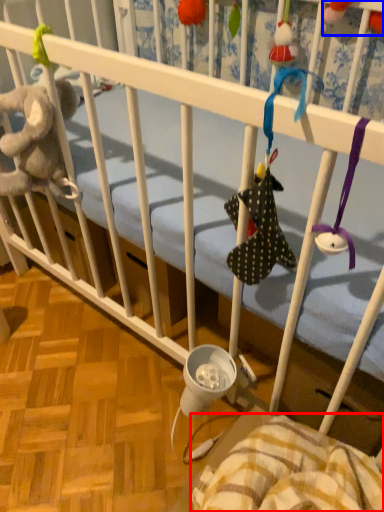
Question: Which of the following is the closest to the observer, blanket (highlighted by a red box) or toy (highlighted by a blue box)?

Choices:
 (A) blanket
 (B) toy

Answer: (A)